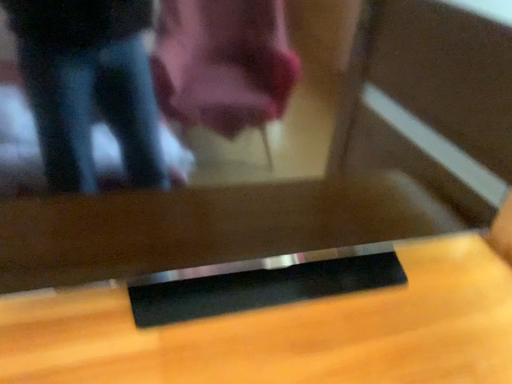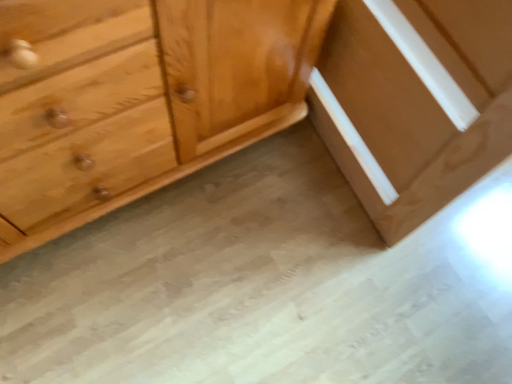
Question: How did the camera likely rotate when shooting the video?

Choices:
 (A) rotated upward
 (B) rotated downward

Answer: (B)